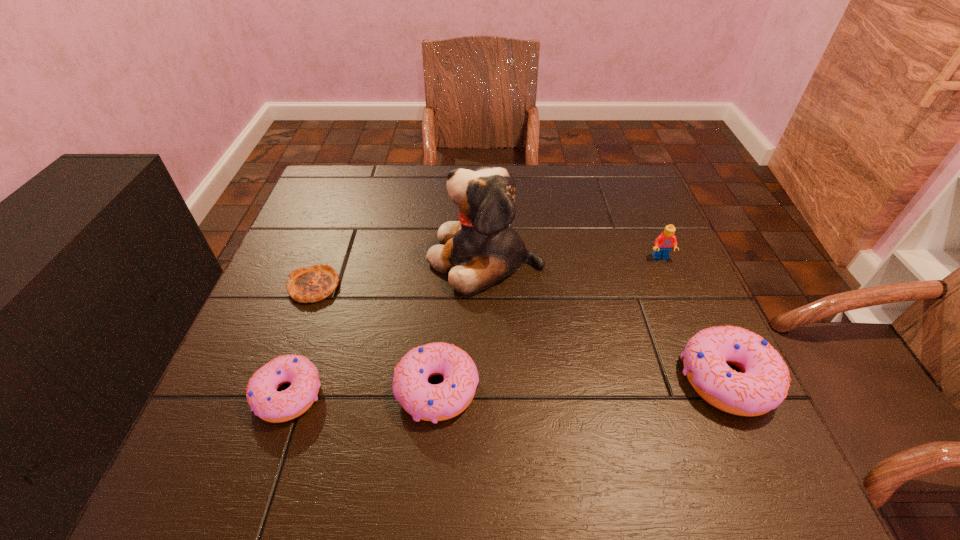
Where is `the leftmost doughnut`? This screenshot has width=960, height=540. the leftmost doughnut is located at coordinates (263, 398).

This screenshot has height=540, width=960. I want to click on the second shortest object, so click(x=263, y=398).

Locate an element on the screen. Image resolution: width=960 pixels, height=540 pixels. the second doughnut from right to left is located at coordinates (423, 401).

Find the location of a particular element. The image size is (960, 540). the fourth tallest object is located at coordinates (423, 401).

In order to click on the rightmost doughnut in this screenshot , I will do [762, 386].

The image size is (960, 540). In order to click on the tallest object in this screenshot , I will do `click(480, 249)`.

At what (x,y) coordinates should I click in order to perform the action: click on the shortest object. Please return your answer as a coordinate pair (x, y). The height and width of the screenshot is (540, 960). Looking at the image, I should click on (313, 283).

Where is `Lego`? This screenshot has width=960, height=540. Lego is located at coordinates (665, 241).

I want to click on vacant space situated 0.320m on the back of the shortest doughnut, so click(x=336, y=254).

Locate an element on the screen. This screenshot has width=960, height=540. vacant area situated 0.290m on the right of the second shortest doughnut is located at coordinates (637, 389).